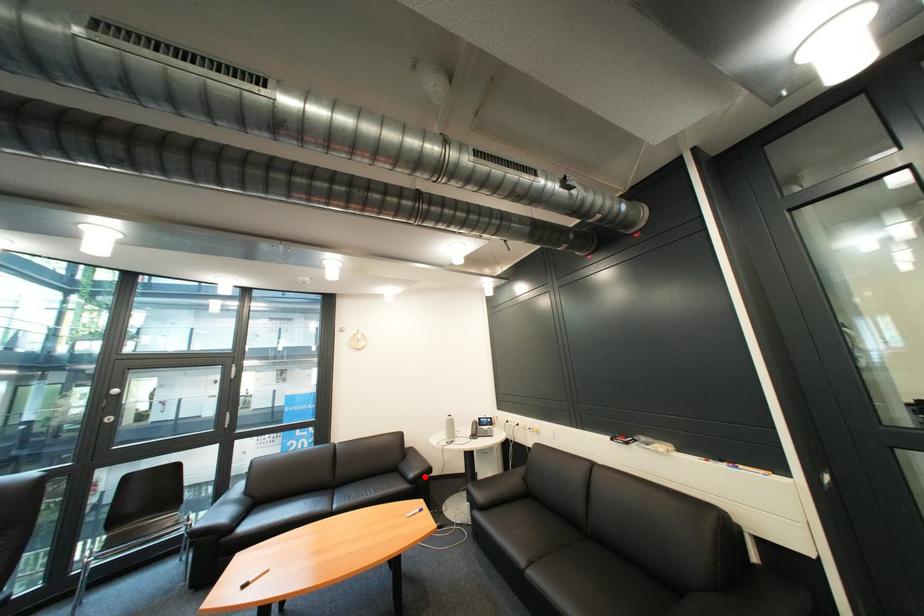
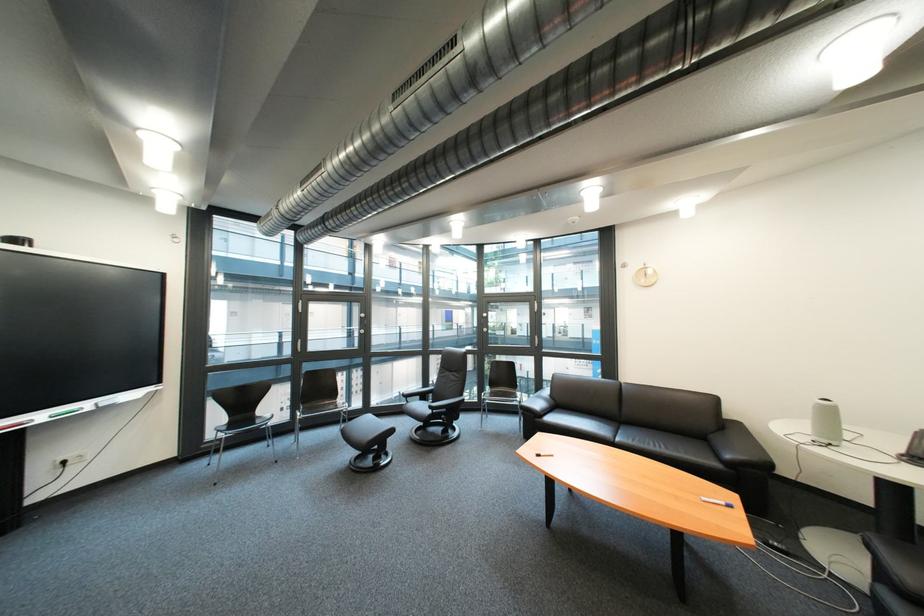
The point at the highlighted location is marked in the first image. Where is the corresponding point in the second image?

(742, 458)